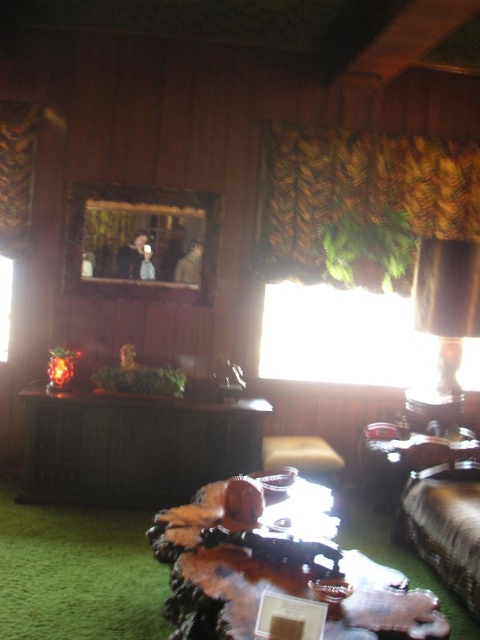
You are a guest in this room and want to place a tall plant on the wooden table at center. Considering the height of the green leafy fabric at upper right, do you think the plant will fit without touching it?

The wooden table at center has a lesser height compared to green leafy fabric at upper right, so the plant should fit without touching the fabric as the table is shorter.

You are standing in the room and looking at the two points marked on the image. Which point, point (261, 572) or point (460, 486), is closer to you?

Point (261, 572) is closer to the camera than point (460, 486), so it is closer to you.

You are a person who wants to place a tall lamp on the wooden table at center. Considering the height of the velvet brown couch at lower right, do you think the lamp will be visible from the couch?

The wooden table at center is not as tall as the velvet brown couch at lower right, so the lamp placed on the wooden table at center may not be fully visible from the couch since the couch is taller.